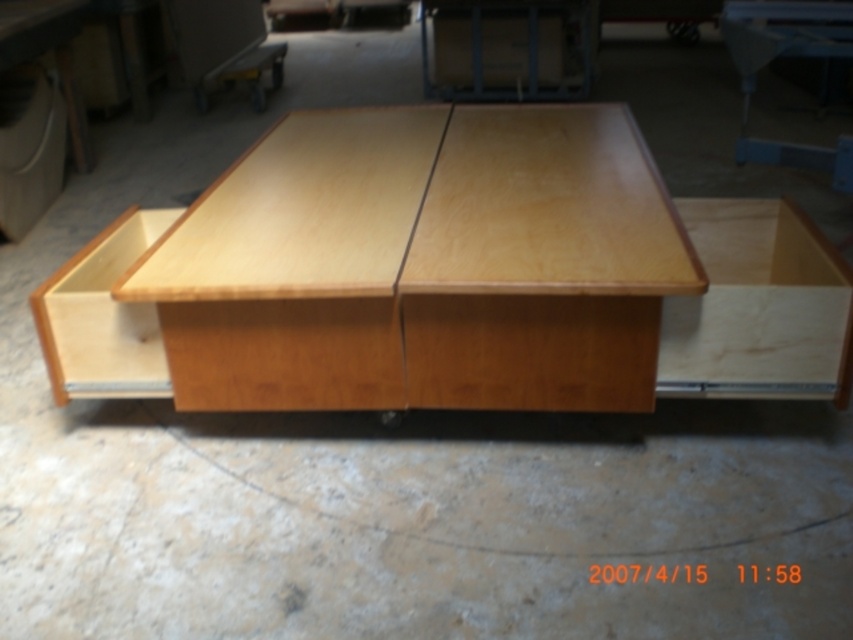
Between light wood table at center and light wood drawer at lower left, which one is positioned higher?

light wood table at center is higher up.

This screenshot has width=853, height=640. What do you see at coordinates (422, 266) in the screenshot? I see `light wood table at center` at bounding box center [422, 266].

Locate an element on the screen. The height and width of the screenshot is (640, 853). light wood table at center is located at coordinates (422, 266).